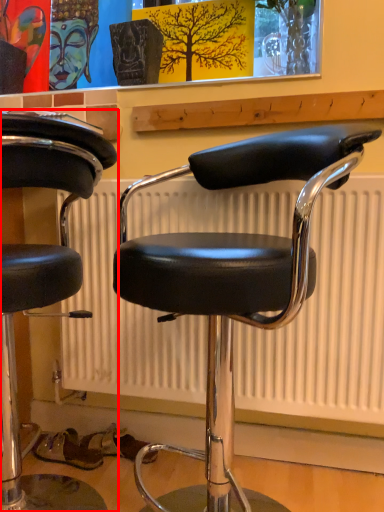
Question: From the image's perspective, where is chair (annotated by the red box) located in relation to chair in the image?

Choices:
 (A) below
 (B) above

Answer: (A)